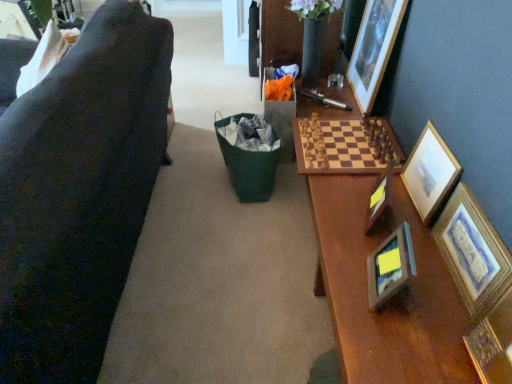
Question: Considering the relative positions of wooden picture frame at upper right, which ranks as the third picture frame in right-to-left order, and wooden framed print at right, which appears as the 1th picture frame when viewed from the right, in the image provided, is wooden picture frame at upper right, which ranks as the third picture frame in right-to-left order, behind wooden framed print at right, which appears as the 1th picture frame when viewed from the right,?

Choices:
 (A) yes
 (B) no

Answer: (A)

Question: From a real-world perspective, is wooden picture frame at upper right, which ranks as the third picture frame in right-to-left order, on top of wooden framed print at right, the sixth picture frame from the left?

Choices:
 (A) no
 (B) yes

Answer: (B)

Question: Is wooden picture frame at upper right, the fourth picture frame viewed from the left, shorter than wooden framed print at right, the sixth picture frame from the left?

Choices:
 (A) yes
 (B) no

Answer: (B)

Question: Considering the relative sizes of wooden picture frame at upper right, which ranks as the third picture frame in right-to-left order, and wooden framed print at right, which appears as the 1th picture frame when viewed from the right, in the image provided, is wooden picture frame at upper right, which ranks as the third picture frame in right-to-left order, smaller than wooden framed print at right, which appears as the 1th picture frame when viewed from the right,?

Choices:
 (A) no
 (B) yes

Answer: (A)

Question: Would you say wooden picture frame at upper right, which ranks as the third picture frame in right-to-left order, is outside wooden framed print at right, the sixth picture frame from the left?

Choices:
 (A) no
 (B) yes

Answer: (B)

Question: Is wooden picture frame at upper right, which ranks as the third picture frame in right-to-left order, taller or shorter than gold-framed picture at right, the 5th picture frame viewed from the left?

Choices:
 (A) tall
 (B) short

Answer: (A)

Question: Is wooden picture frame at upper right, the fourth picture frame viewed from the left, bigger or smaller than gold-framed picture at right, the 5th picture frame viewed from the left?

Choices:
 (A) big
 (B) small

Answer: (A)

Question: Considering the positions of point (376, 23) and point (431, 168), is point (376, 23) closer or farther from the camera than point (431, 168)?

Choices:
 (A) farther
 (B) closer

Answer: (A)

Question: From the image's perspective, is wooden picture frame at upper right, which ranks as the third picture frame in right-to-left order, located above or below gold-framed picture at right, the 2th picture frame viewed from the right?

Choices:
 (A) above
 (B) below

Answer: (A)

Question: From a real-world perspective, is wooden photo frame at center, positioned as the fifth picture frame in right-to-left order, positioned above or below wooden picture frame at upper left, acting as the 6th picture frame starting from the right?

Choices:
 (A) below
 (B) above

Answer: (A)

Question: Looking at the image, does wooden photo frame at center, which is the 2th picture frame from left to right, seem bigger or smaller compared to wooden picture frame at upper left, the first picture frame when ordered from left to right?

Choices:
 (A) small
 (B) big

Answer: (A)

Question: Is wooden photo frame at center, which is the 2th picture frame from left to right, to the left or to the right of wooden picture frame at upper left, acting as the 6th picture frame starting from the right, in the image?

Choices:
 (A) left
 (B) right

Answer: (B)

Question: Considering the positions of wooden photo frame at center, positioned as the fifth picture frame in right-to-left order, and wooden picture frame at upper left, acting as the 6th picture frame starting from the right, in the image, is wooden photo frame at center, positioned as the fifth picture frame in right-to-left order, wider or thinner than wooden picture frame at upper left, acting as the 6th picture frame starting from the right,?

Choices:
 (A) thin
 (B) wide

Answer: (A)

Question: From the image's perspective, is wooden picture frame at upper right, which ranks as the third picture frame in right-to-left order, located above or below wooden picture frame at upper left, acting as the 6th picture frame starting from the right?

Choices:
 (A) below
 (B) above

Answer: (A)

Question: Would you say wooden picture frame at upper right, which ranks as the third picture frame in right-to-left order, is to the left or to the right of wooden picture frame at upper left, acting as the 6th picture frame starting from the right, in the picture?

Choices:
 (A) right
 (B) left

Answer: (A)